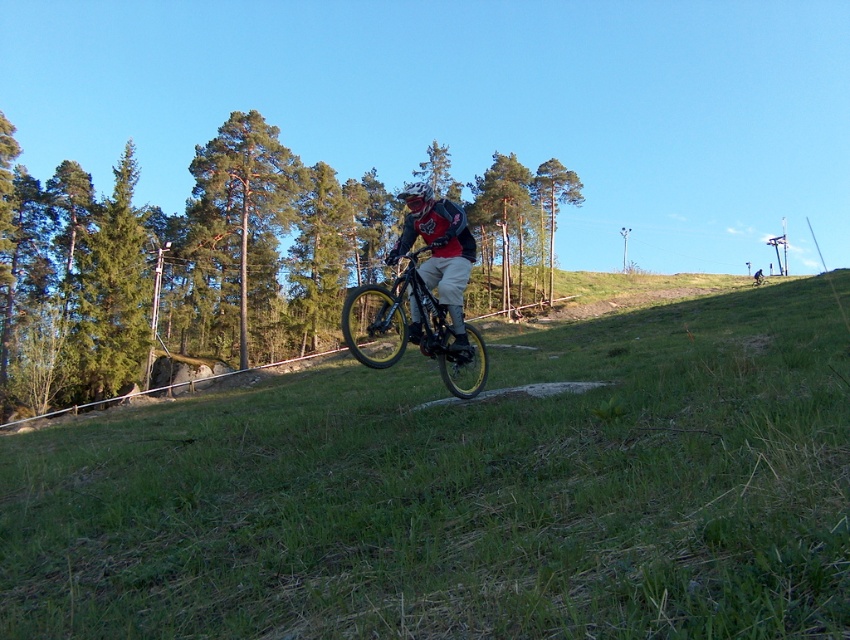
Looking at this image, who is positioned more to the left, green grassy at center or shiny metallic bicycle at center?

shiny metallic bicycle at center

Who is positioned more to the right, green grassy at center or shiny metallic bicycle at center?

Positioned to the right is green grassy at center.

Is point (389, 568) more distant than point (384, 336)?

No, (389, 568) is in front of (384, 336).

The image size is (850, 640). I want to click on green grassy at center, so click(x=463, y=493).

Can you confirm if shiny metallic bicycle at center is taller than matte black helmet at center?

In fact, shiny metallic bicycle at center may be shorter than matte black helmet at center.

Does shiny metallic bicycle at center appear over matte black helmet at center?

No, shiny metallic bicycle at center is not above matte black helmet at center.

This screenshot has height=640, width=850. What do you see at coordinates (411, 330) in the screenshot?
I see `shiny metallic bicycle at center` at bounding box center [411, 330].

At what (x,y) coordinates should I click in order to perform the action: click on shiny metallic bicycle at center. Please return your answer as a coordinate pair (x, y). The width and height of the screenshot is (850, 640). Looking at the image, I should click on (411, 330).

Does green grassy at center come behind matte black helmet at center?

No.

Which of these two, green grassy at center or matte black helmet at center, stands taller?

matte black helmet at center

Identify the location of green grassy at center. Image resolution: width=850 pixels, height=640 pixels. [463, 493].